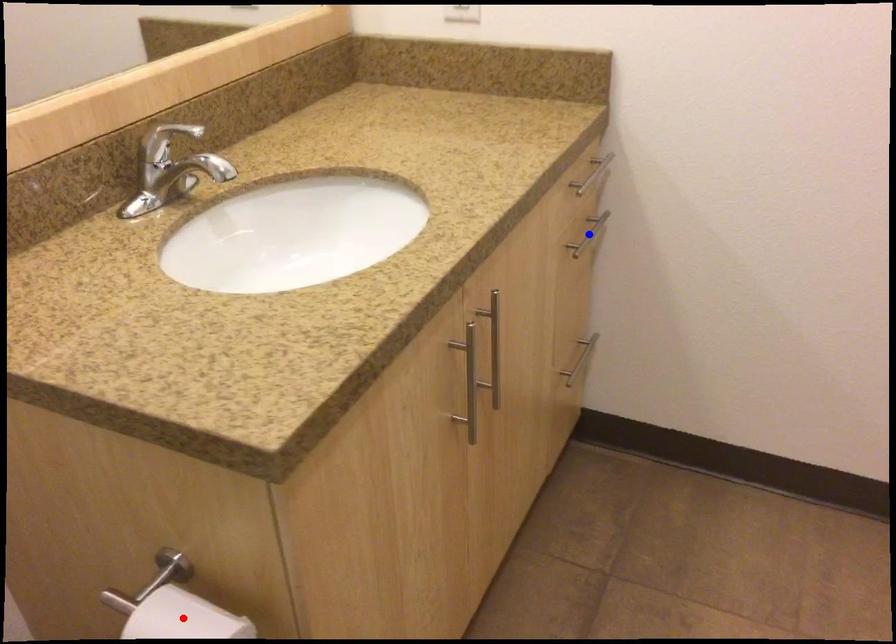
Question: In the image, two points are highlighted. Which point is nearer to the camera? Reply with the corresponding letter.

Choices:
 (A) blue point
 (B) red point

Answer: (B)